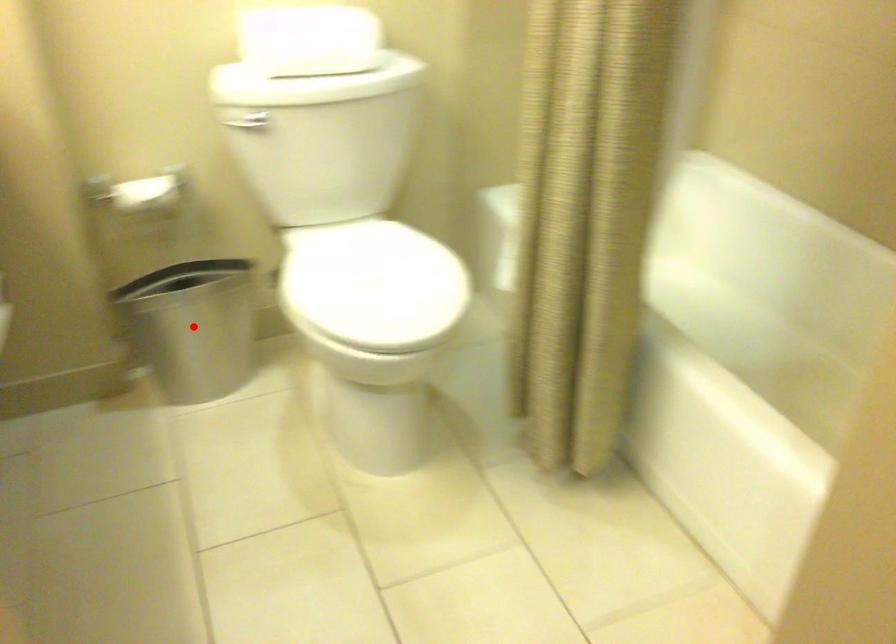
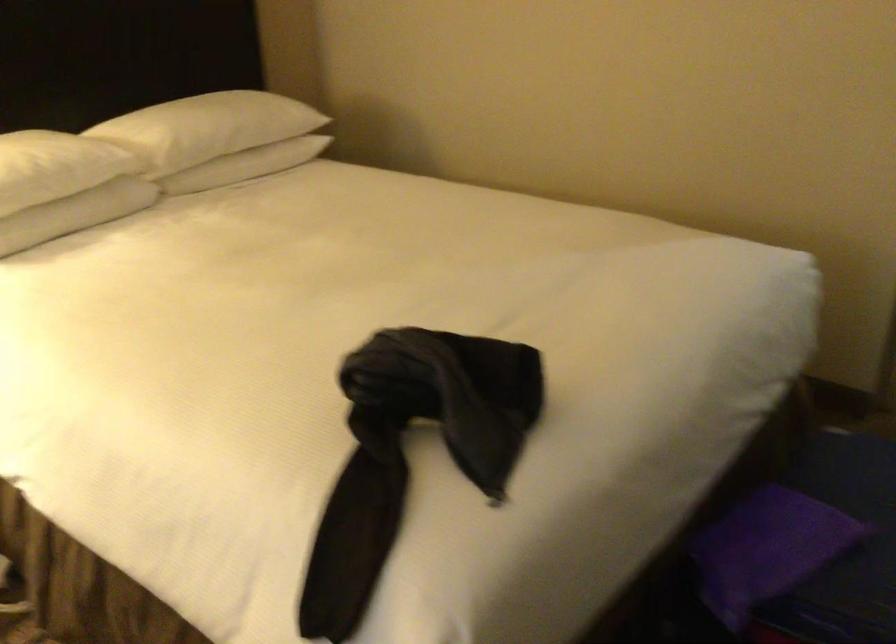
Question: I am providing you with two images of the same scene from different viewpoints. A red point is marked on the first image. At the location where the point appears in image 1, is it still visible in image 2?

Choices:
 (A) Yes
 (B) No

Answer: (B)